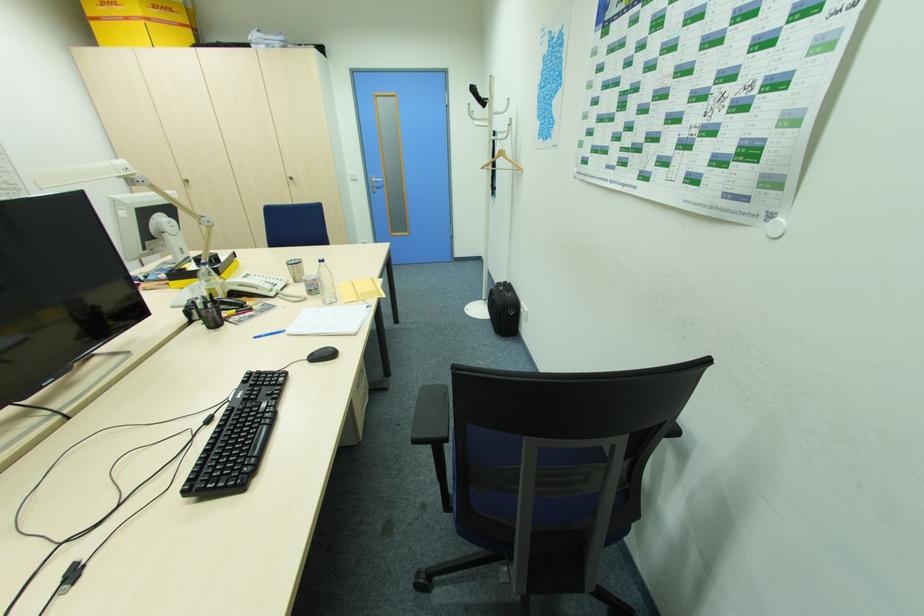
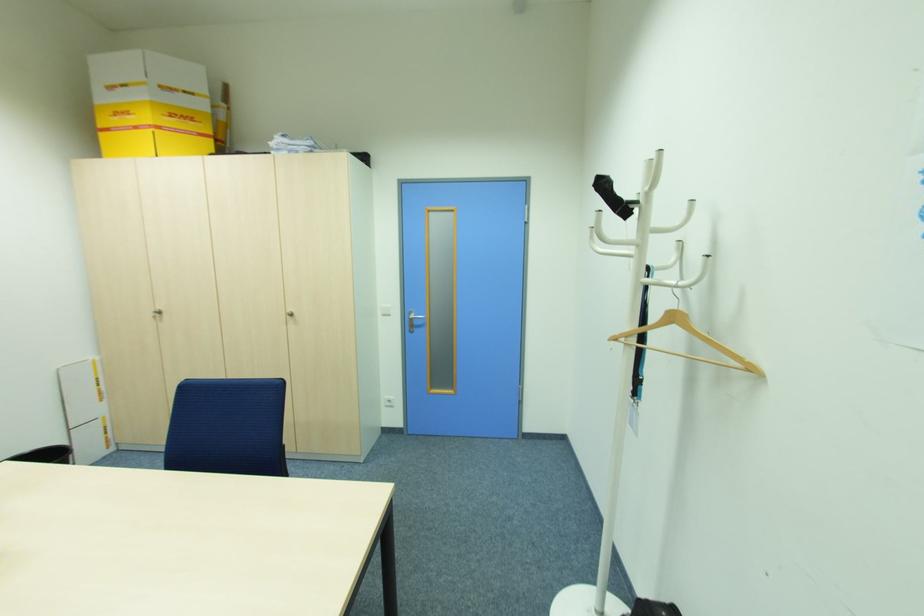
Where in the second image is the point corresponding to [508,100] from the first image?

(688, 204)